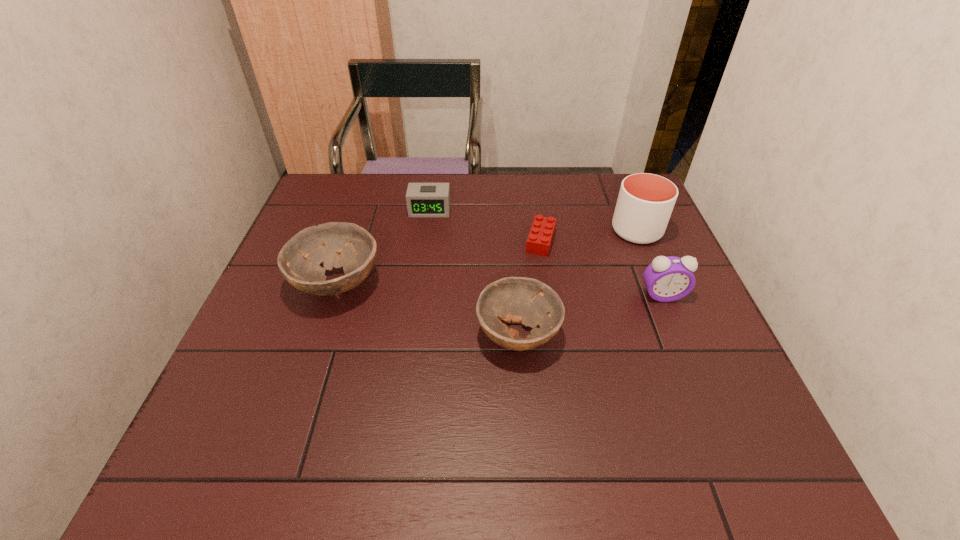
The height and width of the screenshot is (540, 960). I want to click on free space that is in between the cup and the nearer alarm clock, so click(650, 263).

Locate an element on the screen. blank region between the tallest object and the left alarm clock is located at coordinates (534, 220).

The height and width of the screenshot is (540, 960). I want to click on free spot between the Lego and the left bowl, so click(x=439, y=262).

Where is `empty space between the cup and the shorter bowl`? empty space between the cup and the shorter bowl is located at coordinates (577, 282).

Find the location of a particular element. The height and width of the screenshot is (540, 960). free spot between the nearer alarm clock and the third shortest object is located at coordinates (590, 314).

Point out which object is positioned as the second nearest to the leftmost object. Please provide its 2D coordinates. Your answer should be formatted as a tuple, i.e. [(x, y)], where the tuple contains the x and y coordinates of a point satisfying the conditions above.

[(528, 301)]

In order to click on object that is the second closest one to the left bowl in this screenshot , I will do `click(528, 301)`.

I want to click on free spot that satisfies the following two spatial constraints: 1. on the back side of the tallest object; 2. on the left side of the fourth tallest object, so click(x=510, y=231).

This screenshot has height=540, width=960. What are the coordinates of `free space that satisfies the following two spatial constraints: 1. on the front side of the right bowl; 2. on the right side of the leftmost object` in the screenshot? It's located at (x=321, y=334).

Where is `vacant space that satisfies the following two spatial constraints: 1. on the front-facing side of the third shortest object; 2. on the right side of the shorter alarm clock`? The height and width of the screenshot is (540, 960). vacant space that satisfies the following two spatial constraints: 1. on the front-facing side of the third shortest object; 2. on the right side of the shorter alarm clock is located at coordinates (413, 334).